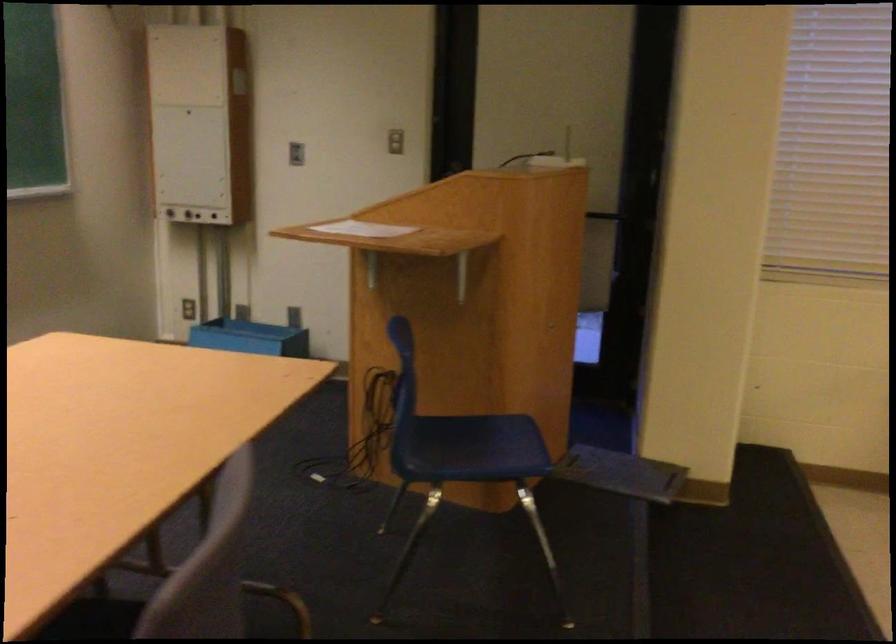
Which object does [250,337] point to?

It refers to a blue plastic bin.